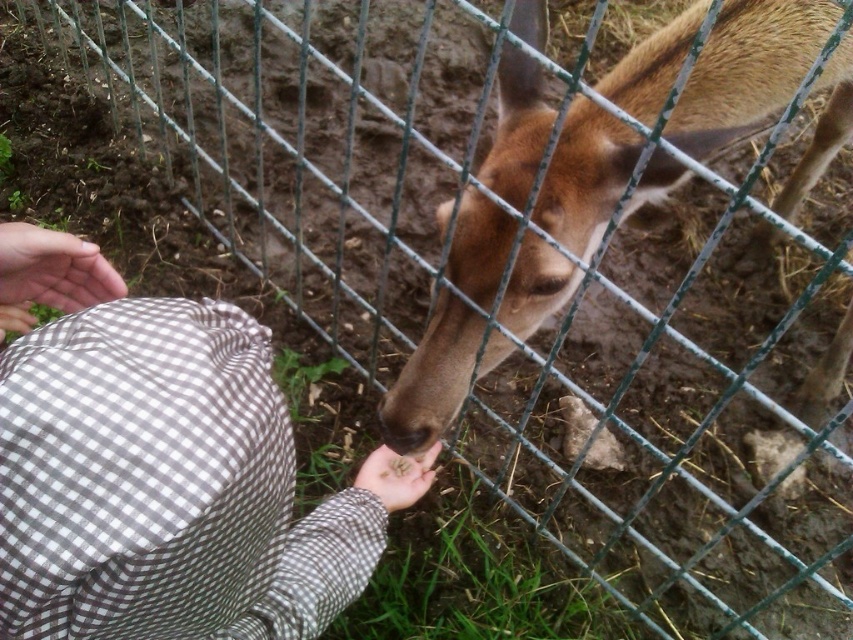
Question: Observing the image, what is the correct spatial positioning of smooth fabric hand at lower left in reference to smooth brown hand at lower center?

Choices:
 (A) below
 (B) above

Answer: (B)

Question: Which of the following is the closest to the observer?

Choices:
 (A) brown matte/deer at center
 (B) smooth fabric hand at lower left
 (C) brown checkered shirt at lower left

Answer: (C)

Question: Observing the image, what is the correct spatial positioning of brown checkered shirt at lower left in reference to smooth brown hand at lower center?

Choices:
 (A) above
 (B) below

Answer: (A)

Question: Among these points, which one is nearest to the camera?

Choices:
 (A) (370, 536)
 (B) (363, 486)
 (C) (76, 269)
 (D) (560, 282)

Answer: (C)

Question: Among these points, which one is farthest from the camera?

Choices:
 (A) (610, 172)
 (B) (36, 264)
 (C) (16, 630)

Answer: (A)

Question: Can you confirm if smooth fabric hand at lower left is positioned to the left of smooth brown hand at lower center?

Choices:
 (A) yes
 (B) no

Answer: (A)